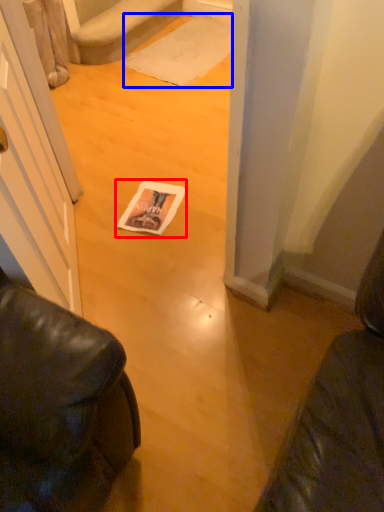
Question: Which point is closer to the camera, magazine (highlighted by a red box) or doormat (highlighted by a blue box)?

Choices:
 (A) magazine
 (B) doormat

Answer: (A)